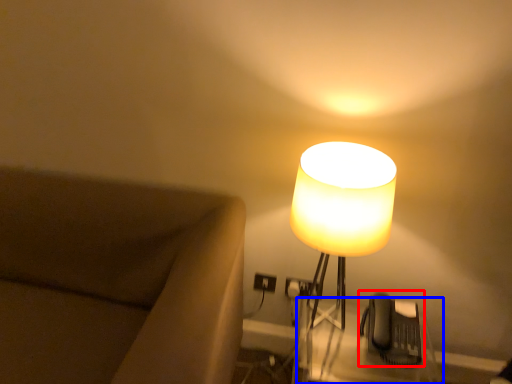
Question: Among these objects, which one is farthest to the camera, swivel chair (highlighted by a red box) or table (highlighted by a blue box)?

Choices:
 (A) swivel chair
 (B) table

Answer: (A)